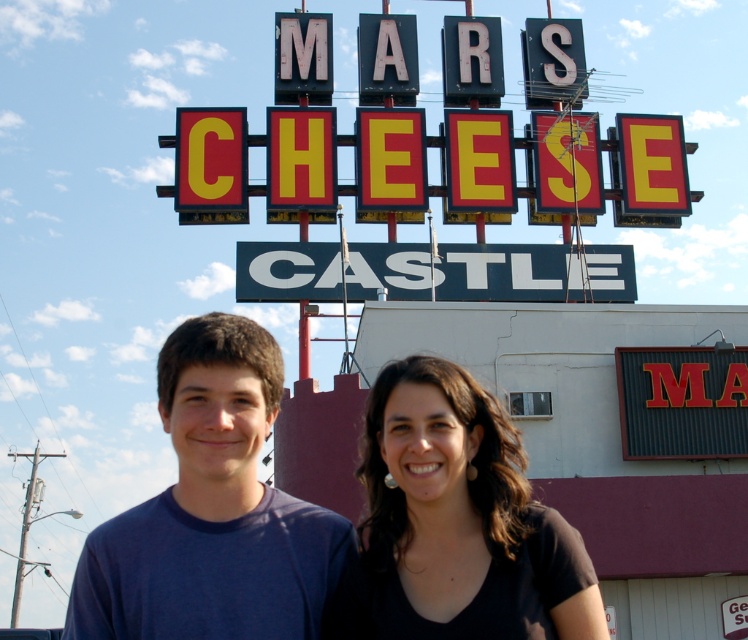
Question: From the image, what is the correct spatial relationship of metallic yellow lettering at center in relation to black metal sign at center?

Choices:
 (A) below
 (B) above

Answer: (B)

Question: Among these objects, which one is farthest from the camera?

Choices:
 (A) black matte hair at center
 (B) metallic yellow lettering at center

Answer: (B)

Question: Is blue t-shirt at center positioned in front of black metal sign at center?

Choices:
 (A) yes
 (B) no

Answer: (A)

Question: Is blue t-shirt at center thinner than black matte hair at center?

Choices:
 (A) no
 (B) yes

Answer: (A)

Question: Which object is closer to the camera taking this photo?

Choices:
 (A) black metal sign at center
 (B) black matte hair at center

Answer: (B)

Question: Which point appears closest to the camera in this image?

Choices:
 (A) (245, 554)
 (B) (468, 248)

Answer: (A)